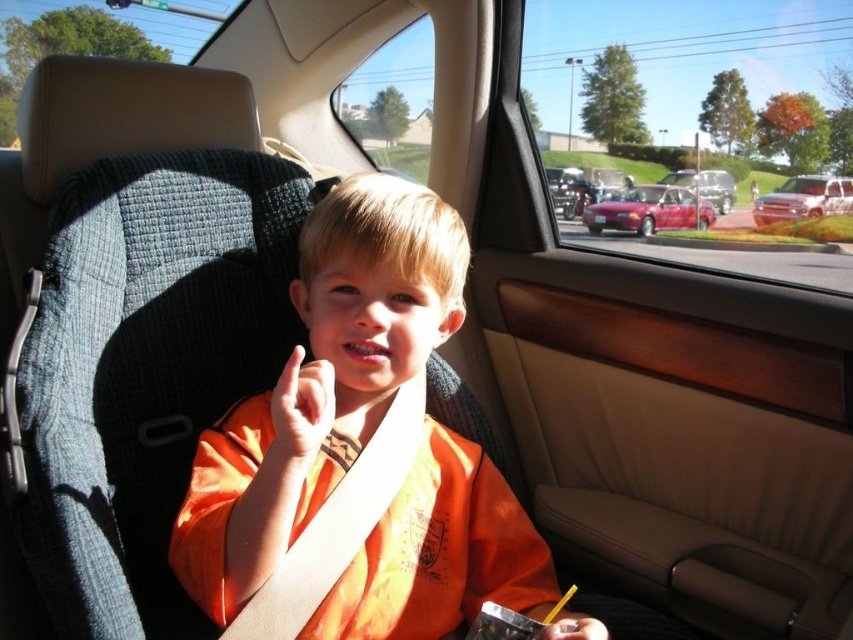
Consider the image. The child is sitting in the back seat of a car. There is a point marked at coordinates (321, 381). What object is located at that point?

The point at coordinates (321, 381) marks the orange fabric shirt at center.

You are a passenger in the car and want to know which vehicle is higher up in the image. Which one is positioned higher between the shiny red sedan at center and the white glossy truck at right?

The shiny red sedan at center is positioned higher than the white glossy truck at right in the image.